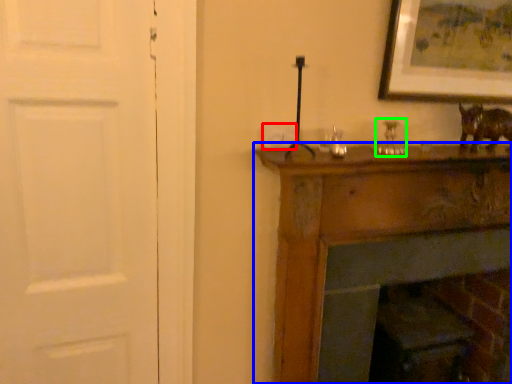
Question: Estimate the real-world distances between objects in this image. Which object is closer to light switch (highlighted by a red box), furniture (highlighted by a blue box) or candle holder (highlighted by a green box)?

Choices:
 (A) furniture
 (B) candle holder

Answer: (B)